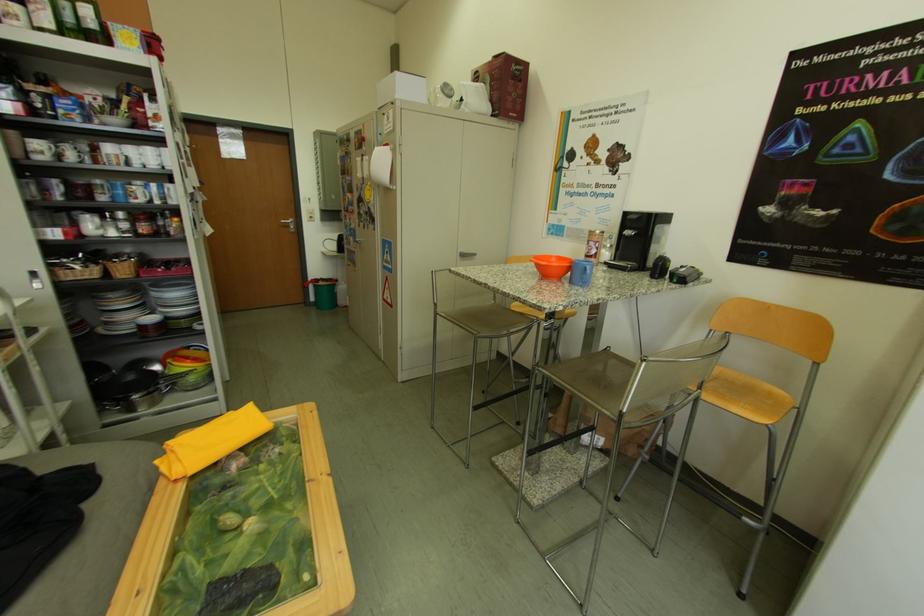
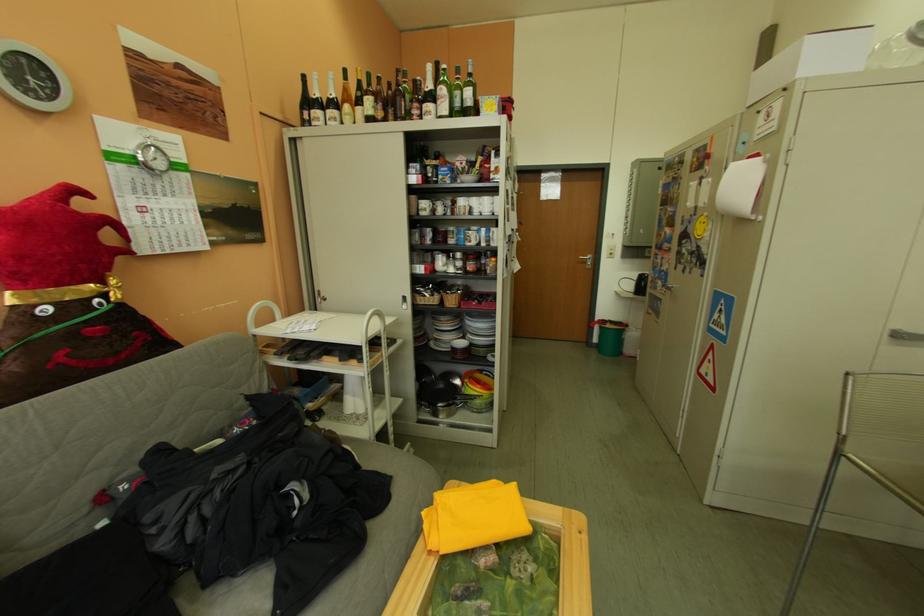
The point at (447, 100) is marked in the first image. Where is the corresponding point in the second image?

(904, 55)